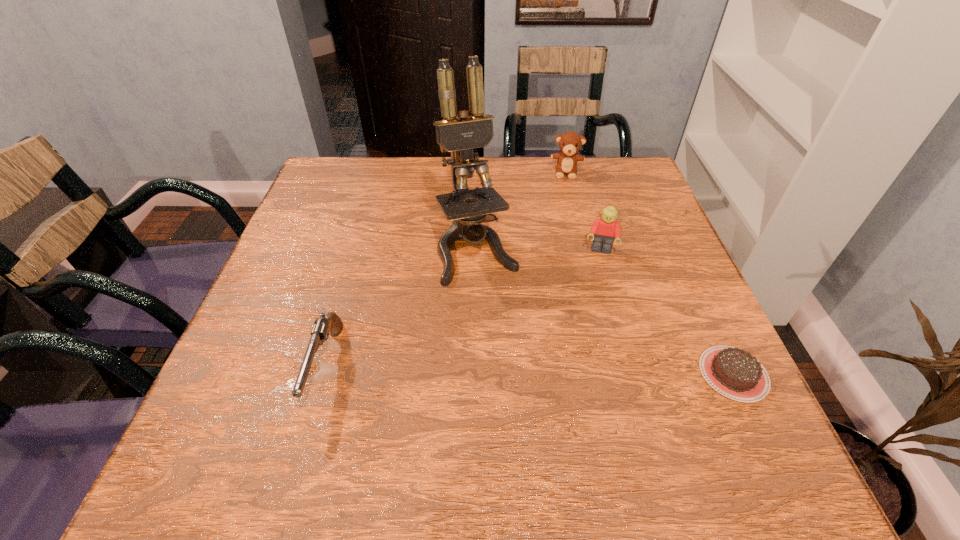
The height and width of the screenshot is (540, 960). I want to click on unoccupied position between the chocolate cake and the tallest object, so click(x=606, y=312).

You are a GUI agent. You are given a task and a screenshot of the screen. Output one action in this format:
    pyautogui.click(x=<x>, y=<y>)
    Task: Click on the free spot between the chocolate cake and the tallest object
    
    Given the screenshot: What is the action you would take?
    pyautogui.click(x=606, y=312)

Identify which object is the third closest to the teddy bear. Please provide its 2D coordinates. Your answer should be formatted as a tuple, i.e. [(x, y)], where the tuple contains the x and y coordinates of a point satisfying the conditions above.

[(736, 374)]

You are a GUI agent. You are given a task and a screenshot of the screen. Output one action in this format:
    pyautogui.click(x=<x>, y=<y>)
    Task: Click on the object that stands as the second closest to the fourth object from right to left
    The height and width of the screenshot is (540, 960).
    Given the screenshot: What is the action you would take?
    pyautogui.click(x=320, y=332)

Find the location of `free spot that satisfies the following two spatial constraints: 1. aiming along the barrel of the gun; 2. on the right side of the shortest object`. free spot that satisfies the following two spatial constraints: 1. aiming along the barrel of the gun; 2. on the right side of the shortest object is located at coordinates (324, 374).

The height and width of the screenshot is (540, 960). I want to click on blank space that satisfies the following two spatial constraints: 1. on the front side of the chocolate cake; 2. on the right side of the fourth object from right to left, so click(476, 374).

You are a GUI agent. You are given a task and a screenshot of the screen. Output one action in this format:
    pyautogui.click(x=<x>, y=<y>)
    Task: Click on the vacant space that satisfies the following two spatial constraints: 1. on the front side of the second object from left to right; 2. on the left side of the Lego
    The height and width of the screenshot is (540, 960).
    Given the screenshot: What is the action you would take?
    pyautogui.click(x=477, y=252)

What are the coordinates of `free space that satisfies the following two spatial constraints: 1. on the front side of the second object from left to right; 2. on the left side of the Lego` in the screenshot? It's located at (477, 252).